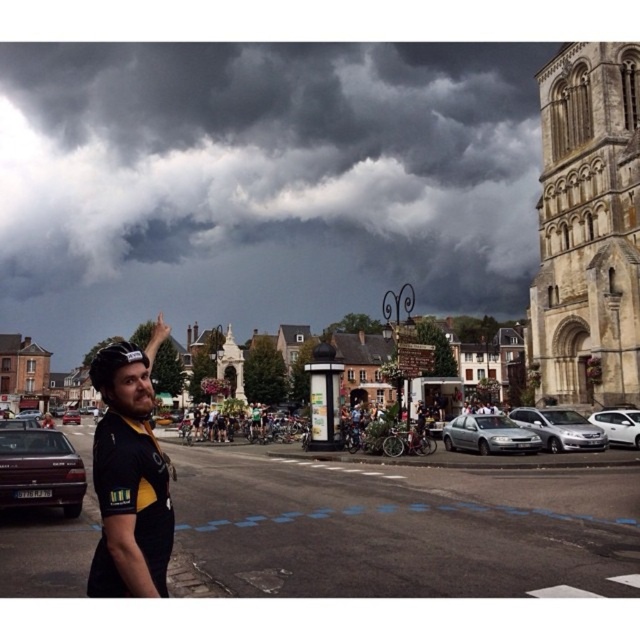
You are a pedestrian trying to cross the street from the sidewalk where the cyclist is standing. There are two sedans, the matte black sedan at left and the satin silver sedan at center. Which sedan is closer to you as you stand on the sidewalk?

The matte black sedan at left is closer to you because it is positioned in front of the satin silver sedan at center, meaning it is nearer to your current position on the sidewalk.

You are a delivery person needing to park your 1.8 meters tall delivery cart between the satin silver sedan at center and the white glossy sedan at right. Can you fit it vertically between them?

The satin silver sedan at center is taller than the white glossy sedan at right. Since the delivery cart is 1.8 meters tall, you need to check the vertical space between them. However, the description only provides their relative heights, not the distance between them. Without knowing the distance between the two sedans, it is impossible to determine if the delivery cart can fit vertically.